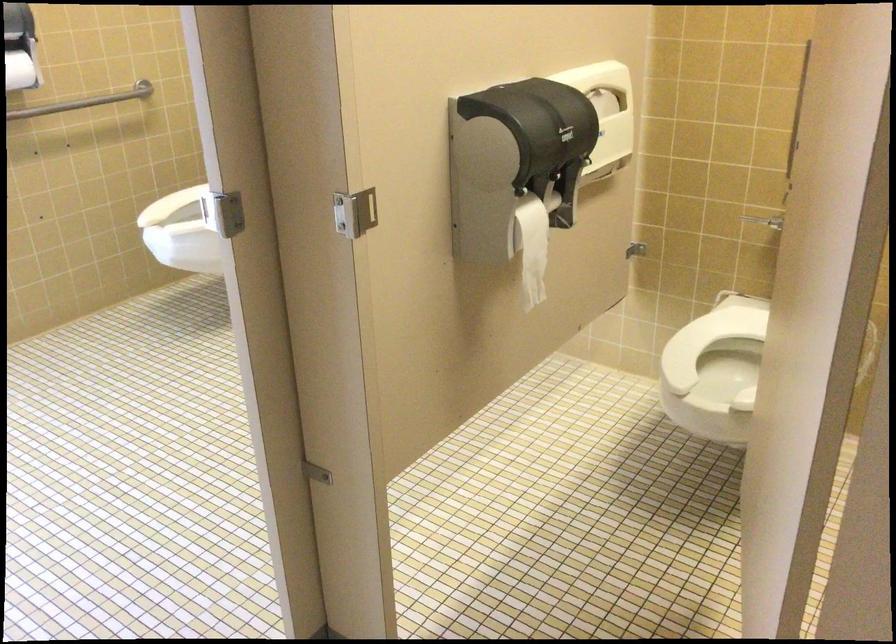
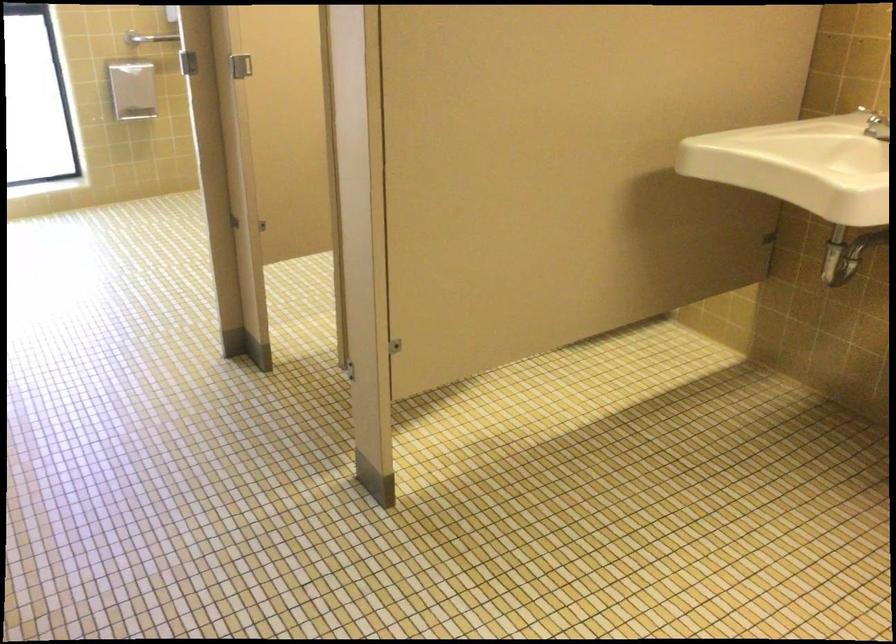
Question: I am providing you with two images of the same scene from different viewpoints. Please identify which objects are invisible in image2.

Choices:
 (A) metal grab bar
 (B) white toilet seat
 (C) silver faucet handle
 (D) plastic bottle lid

Answer: (B)